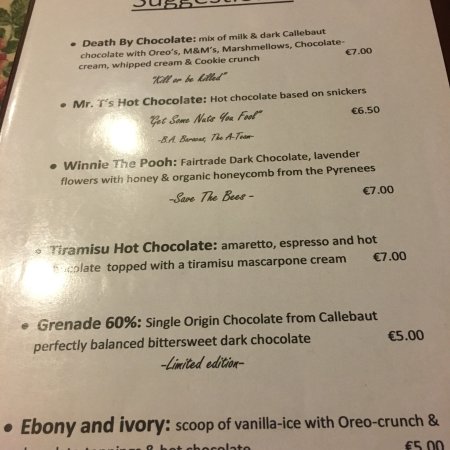
Identify the location of table cloth underneath the menu. The height and width of the screenshot is (450, 450). [12, 18].